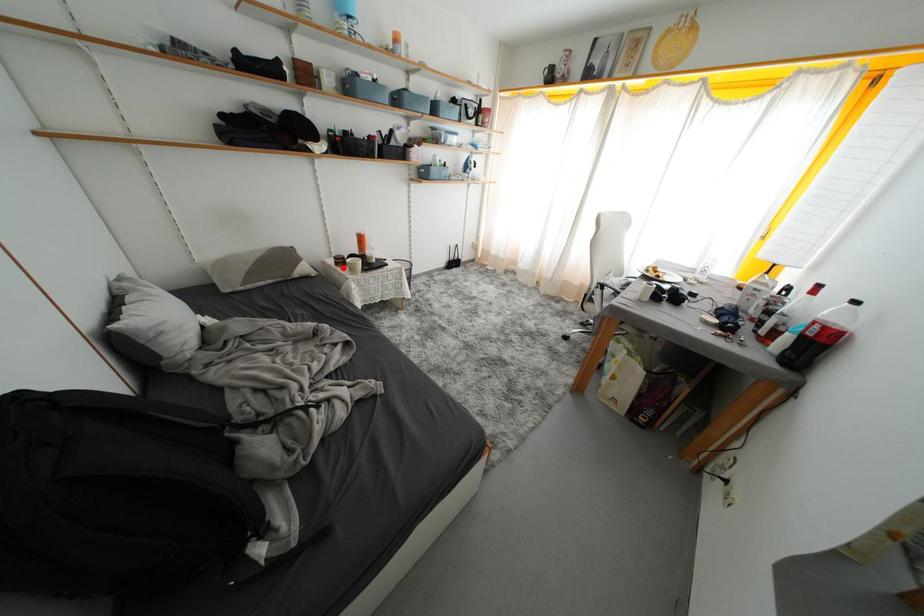
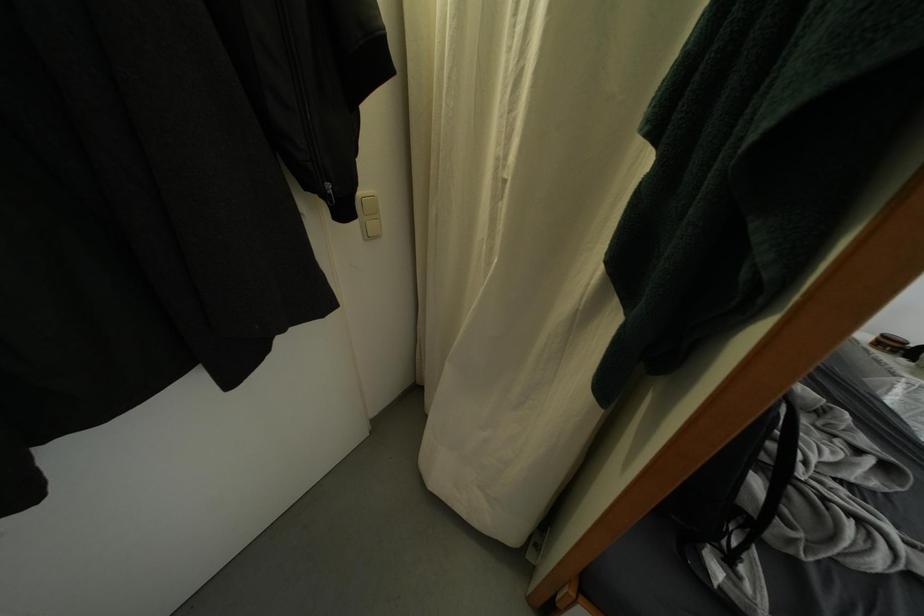
Question: I am providing you with two images of the same scene from different viewpoints. In image1, a red point is highlighted. Considering the same 3D point in image2, which of the following is correct?

Choices:
 (A) It is closer
 (B) It is farther

Answer: (B)